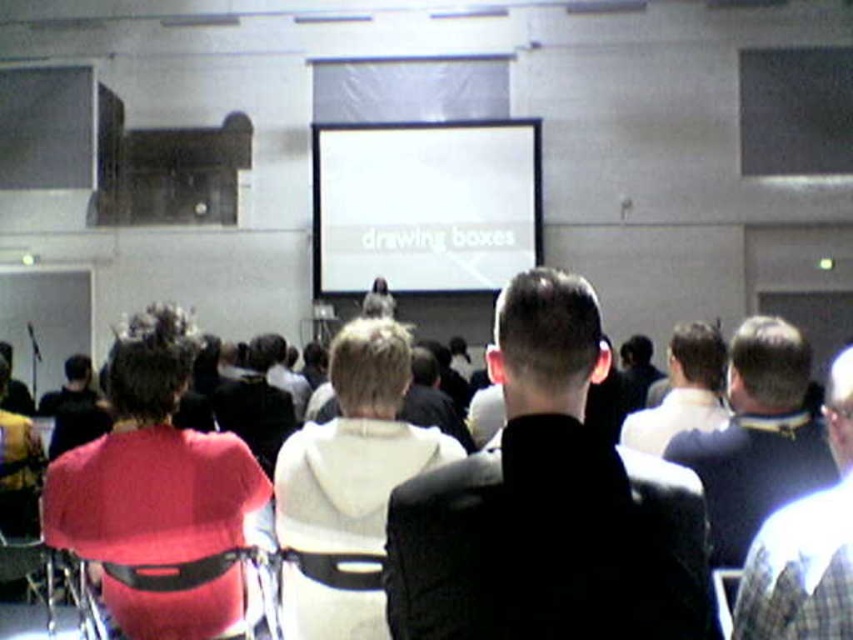
Image resolution: width=853 pixels, height=640 pixels. Identify the location of black suit at center. (548, 506).

Can you confirm if black suit at center is positioned to the right of white matte projection screen at center?

Indeed, black suit at center is positioned on the right side of white matte projection screen at center.

Identify the location of black suit at center. (548, 506).

Is point (724, 445) positioned before point (715, 404)?

Yes, it is in front of point (715, 404).

Does dark brown leather jacket at center have a lesser height compared to light brown hair at center?

In fact, dark brown leather jacket at center may be taller than light brown hair at center.

Is point (737, 472) positioned behind point (688, 417)?

No, (737, 472) is in front of (688, 417).

At what (x,y) coordinates should I click in order to perform the action: click on dark brown leather jacket at center. Please return your answer as a coordinate pair (x, y). Image resolution: width=853 pixels, height=640 pixels. Looking at the image, I should click on (757, 436).

Is matte red shirt at center to the left of light brown hair at center from the viewer's perspective?

Indeed, matte red shirt at center is positioned on the left side of light brown hair at center.

Who is more distant from viewer, [64,490] or [694,330]?

Point [694,330]

The width and height of the screenshot is (853, 640). Find the location of `matte red shirt at center`. matte red shirt at center is located at coordinates (155, 488).